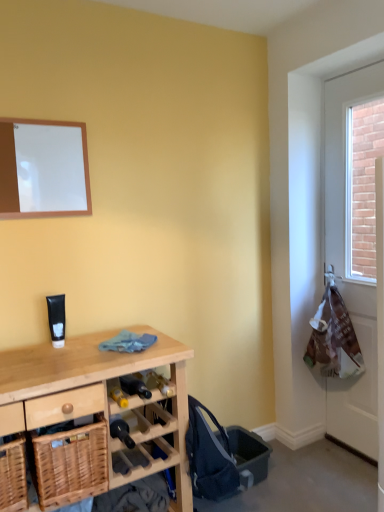
Measure the distance between point (22, 503) and camera.

The depth of point (22, 503) is 4.44 feet.

Where is `wooden desk at lower left`? wooden desk at lower left is located at coordinates click(x=98, y=396).

From a real-world perspective, is white plastic bag at right above or below white matte board at upper left?

From a real-world perspective, white plastic bag at right is physically below white matte board at upper left.

Considering the sizes of white plastic bag at right and white matte board at upper left in the image, is white plastic bag at right wider or thinner than white matte board at upper left?

Considering their sizes, white plastic bag at right looks broader than white matte board at upper left.

You are a GUI agent. You are given a task and a screenshot of the screen. Output one action in this format:
    pyautogui.click(x=<x>, y=<y>)
    Task: Click on the mirror on the left of white plastic bag at right
    
    Given the screenshot: What is the action you would take?
    pyautogui.click(x=43, y=169)

From the image's perspective, does white plastic bag at right appear higher than white matte board at upper left?

No, from the image's perspective, white plastic bag at right is not over white matte board at upper left.

From a real-world perspective, who is located lower, woven wood basket at lower left, which ranks as the 2th basket in left-to-right order, or woven wood basket at lower left, acting as the first basket starting from the left?

woven wood basket at lower left, acting as the first basket starting from the left, from a real-world perspective.

This screenshot has width=384, height=512. I want to click on basket in front of the woven wood basket at lower left, which ranks as the 2th basket in left-to-right order, so click(x=13, y=476).

Is woven wood basket at lower left, which ranks as the 2th basket in left-to-right order, situated inside woven wood basket at lower left, acting as the first basket starting from the left, or outside?

woven wood basket at lower left, which ranks as the 2th basket in left-to-right order, cannot be found inside woven wood basket at lower left, acting as the first basket starting from the left.

In the scene shown: Is woven wood basket at lower left, which ranks as the first basket in right-to-left order, taller than woven wood basket at lower left, the 2th basket in the right-to-left sequence?

Yes, woven wood basket at lower left, which ranks as the first basket in right-to-left order, is taller than woven wood basket at lower left, the 2th basket in the right-to-left sequence.

Which object is further away from the camera, white matte board at upper left or woven wood basket at lower left, acting as the first basket starting from the left?

white matte board at upper left is further away from the camera.

At what (x,y) coordinates should I click in order to perform the action: click on mirror lying on the right of woven wood basket at lower left, the 2th basket in the right-to-left sequence. Please return your answer as a coordinate pair (x, y). Looking at the image, I should click on tap(43, 169).

Who is bigger, white matte board at upper left or woven wood basket at lower left, the 2th basket in the right-to-left sequence?

Bigger between the two is woven wood basket at lower left, the 2th basket in the right-to-left sequence.

Which object is positioned more to the left, white matte board at upper left or woven wood basket at lower left, the 2th basket in the right-to-left sequence?

woven wood basket at lower left, the 2th basket in the right-to-left sequence.

Is white matte board at upper left at the back of wooden desk at lower left?

No, wooden desk at lower left is not facing the opposite direction of white matte board at upper left.

Is wooden desk at lower left inside the boundaries of white matte board at upper left, or outside?

wooden desk at lower left lies outside white matte board at upper left.

At what (x,y) coordinates should I click in order to perform the action: click on desk that is below the white matte board at upper left (from the image's perspective). Please return your answer as a coordinate pair (x, y). The width and height of the screenshot is (384, 512). Looking at the image, I should click on (98, 396).

How many degrees apart are the facing directions of wooden desk at lower left and white matte board at upper left?

wooden desk at lower left and white matte board at upper left are facing 0.00704 degrees away from each other.

Is white matte board at upper left facing away from woven wood basket at lower left, which ranks as the first basket in right-to-left order?

That's not correct — white matte board at upper left is not looking away from woven wood basket at lower left, which ranks as the first basket in right-to-left order.

Is white matte board at upper left to the left or to the right of woven wood basket at lower left, which ranks as the first basket in right-to-left order, in the image?

Based on their positions, white matte board at upper left is located to the left of woven wood basket at lower left, which ranks as the first basket in right-to-left order.

Can you tell me how much white matte board at upper left and woven wood basket at lower left, which ranks as the 2th basket in left-to-right order, differ in facing direction?

0.00684 degrees separate the facing orientations of white matte board at upper left and woven wood basket at lower left, which ranks as the 2th basket in left-to-right order.

Can you confirm if white matte board at upper left is wider than woven wood basket at lower left, which ranks as the 2th basket in left-to-right order?

Incorrect, the width of white matte board at upper left does not surpass that of woven wood basket at lower left, which ranks as the 2th basket in left-to-right order.

Is wooden desk at lower left oriented towards woven wood basket at lower left, acting as the first basket starting from the left?

No, wooden desk at lower left is not oriented towards woven wood basket at lower left, acting as the first basket starting from the left.

Which object is further away from the camera, wooden desk at lower left or woven wood basket at lower left, the 2th basket in the right-to-left sequence?

woven wood basket at lower left, the 2th basket in the right-to-left sequence, is further from the camera.

Is the surface of wooden desk at lower left in direct contact with woven wood basket at lower left, the 2th basket in the right-to-left sequence?

No, wooden desk at lower left is not beside woven wood basket at lower left, the 2th basket in the right-to-left sequence.

From the image's perspective, is wooden desk at lower left on woven wood basket at lower left, the 2th basket in the right-to-left sequence?

Incorrect, from the image's perspective, wooden desk at lower left is lower than woven wood basket at lower left, the 2th basket in the right-to-left sequence.

What's the angular difference between woven wood basket at lower left, acting as the first basket starting from the left, and wooden desk at lower left's facing directions?

The facing directions of woven wood basket at lower left, acting as the first basket starting from the left, and wooden desk at lower left are 0.00184 degrees apart.

Which object is wider, woven wood basket at lower left, acting as the first basket starting from the left, or wooden desk at lower left?

With larger width is wooden desk at lower left.

From the image's perspective, is woven wood basket at lower left, acting as the first basket starting from the left, under wooden desk at lower left?

Incorrect, from the image's perspective, woven wood basket at lower left, acting as the first basket starting from the left, is higher than wooden desk at lower left.

Identify the location of mirror that is above the white plastic bag at right (from a real-world perspective). (43, 169).

Find the location of `basket located above the woven wood basket at lower left, acting as the first basket starting from the left (from the image's perspective)`. basket located above the woven wood basket at lower left, acting as the first basket starting from the left (from the image's perspective) is located at coordinates (70, 464).

Which object lies nearer to the anchor point woven wood basket at lower left, the 2th basket in the right-to-left sequence, white plastic bag at right or wooden desk at lower left?

wooden desk at lower left is positioned closer to the anchor woven wood basket at lower left, the 2th basket in the right-to-left sequence.

From the picture: Based on their spatial positions, is wooden desk at lower left or white matte board at upper left further from woven wood basket at lower left, acting as the first basket starting from the left?

white matte board at upper left is positioned further to the anchor woven wood basket at lower left, acting as the first basket starting from the left.

Based on their spatial positions, is wooden desk at lower left or woven wood basket at lower left, which ranks as the first basket in right-to-left order, closer to woven wood basket at lower left, acting as the first basket starting from the left?

woven wood basket at lower left, which ranks as the first basket in right-to-left order, is closer to woven wood basket at lower left, acting as the first basket starting from the left.

Looking at this image, when comparing their distances from wooden desk at lower left, does white plastic bag at right or white matte board at upper left seem closer?

white matte board at upper left is positioned closer to the anchor wooden desk at lower left.

Estimate the real-world distances between objects in this image. Which object is closer to white plastic bag at right, woven wood basket at lower left, acting as the first basket starting from the left, or white matte board at upper left?

The object closer to white plastic bag at right is white matte board at upper left.

Looking at the image, which one is located further to woven wood basket at lower left, which ranks as the first basket in right-to-left order, woven wood basket at lower left, the 2th basket in the right-to-left sequence, or wooden desk at lower left?

The object further to woven wood basket at lower left, which ranks as the first basket in right-to-left order, is wooden desk at lower left.

Considering their positions, is wooden desk at lower left positioned further to woven wood basket at lower left, acting as the first basket starting from the left, than white plastic bag at right?

white plastic bag at right is positioned further to the anchor woven wood basket at lower left, acting as the first basket starting from the left.

Looking at this image, estimate the real-world distances between objects in this image. Which object is further from white matte board at upper left, woven wood basket at lower left, acting as the first basket starting from the left, or woven wood basket at lower left, which ranks as the 2th basket in left-to-right order?

woven wood basket at lower left, acting as the first basket starting from the left, lies further to white matte board at upper left than the other object.

I want to click on desk situated between woven wood basket at lower left, acting as the first basket starting from the left, and white plastic bag at right from left to right, so click(x=98, y=396).

The width and height of the screenshot is (384, 512). I want to click on basket between woven wood basket at lower left, the 2th basket in the right-to-left sequence, and wooden desk at lower left from left to right, so click(70, 464).

You are a GUI agent. You are given a task and a screenshot of the screen. Output one action in this format:
    pyautogui.click(x=<x>, y=<y>)
    Task: Click on the mirror situated between woven wood basket at lower left, the 2th basket in the right-to-left sequence, and white plastic bag at right from left to right
    The image size is (384, 512).
    Given the screenshot: What is the action you would take?
    pyautogui.click(x=43, y=169)

Identify the location of basket located between woven wood basket at lower left, acting as the first basket starting from the left, and white plastic bag at right in the left-right direction. The image size is (384, 512). (70, 464).